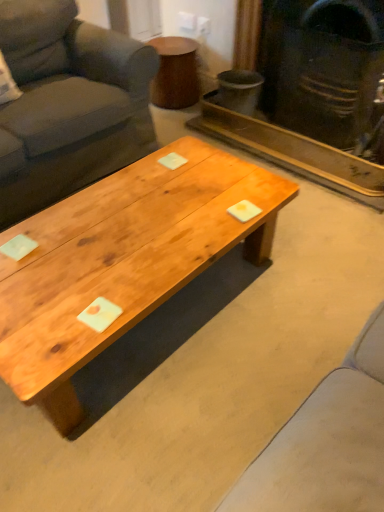
Question: Can you confirm if dark gray fabric couch at left is thinner than matte black fireplace at upper right?

Choices:
 (A) no
 (B) yes

Answer: (A)

Question: From a real-world perspective, is dark gray fabric couch at left located higher than matte black fireplace at upper right?

Choices:
 (A) yes
 (B) no

Answer: (B)

Question: Is dark gray fabric couch at left to the left of matte black fireplace at upper right from the viewer's perspective?

Choices:
 (A) no
 (B) yes

Answer: (B)

Question: Is the position of dark gray fabric couch at left more distant than that of matte black fireplace at upper right?

Choices:
 (A) no
 (B) yes

Answer: (A)

Question: Can you confirm if dark gray fabric couch at left is shorter than matte black fireplace at upper right?

Choices:
 (A) yes
 (B) no

Answer: (A)

Question: Are dark gray fabric couch at left and matte black fireplace at upper right located far from each other?

Choices:
 (A) no
 (B) yes

Answer: (A)

Question: Considering the relative positions of matte black fireplace at upper right and natural wood coffee table at center in the image provided, is matte black fireplace at upper right in front of natural wood coffee table at center?

Choices:
 (A) yes
 (B) no

Answer: (B)

Question: Is natural wood coffee table at center completely or partially inside matte black fireplace at upper right?

Choices:
 (A) no
 (B) yes

Answer: (A)

Question: Can you confirm if matte black fireplace at upper right is smaller than natural wood coffee table at center?

Choices:
 (A) no
 (B) yes

Answer: (B)

Question: Is matte black fireplace at upper right far away from natural wood coffee table at center?

Choices:
 (A) no
 (B) yes

Answer: (B)

Question: From the image's perspective, does matte black fireplace at upper right appear lower than natural wood coffee table at center?

Choices:
 (A) no
 (B) yes

Answer: (A)

Question: Does matte black fireplace at upper right turn towards natural wood coffee table at center?

Choices:
 (A) yes
 (B) no

Answer: (A)

Question: Can you confirm if wooden side table at upper center is thinner than matte black fireplace at upper right?

Choices:
 (A) no
 (B) yes

Answer: (A)